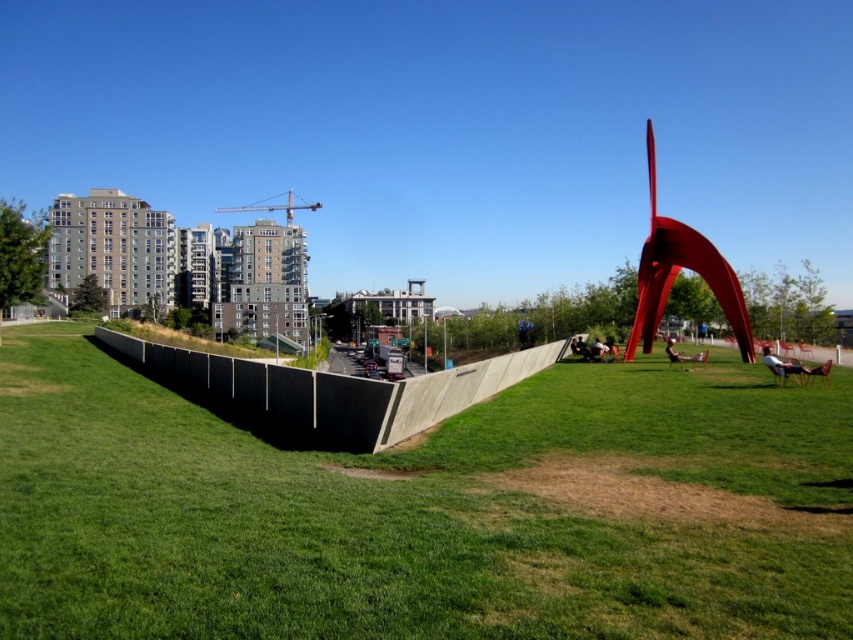
Question: Which point is farther to the camera?

Choices:
 (A) (16, 420)
 (B) (728, 300)

Answer: (B)

Question: Which object is closer to the camera taking this photo?

Choices:
 (A) polished red metal abstract art at right
 (B) green grassy at center

Answer: (B)

Question: Is green grassy at center to the left of polished red metal abstract art at right from the viewer's perspective?

Choices:
 (A) no
 (B) yes

Answer: (B)

Question: Is the position of green grassy at center more distant than that of polished red metal abstract art at right?

Choices:
 (A) yes
 (B) no

Answer: (B)

Question: Is green grassy at center wider than polished red metal abstract art at right?

Choices:
 (A) yes
 (B) no

Answer: (B)